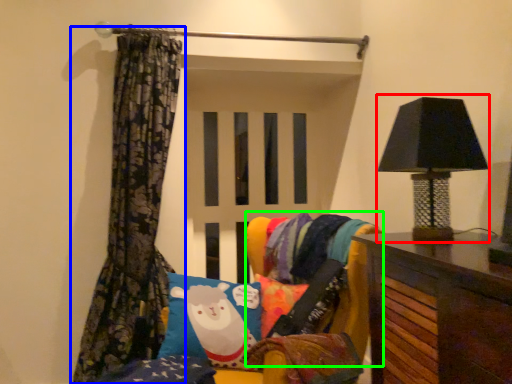
Question: Estimate the real-world distances between objects in this image. Which object is closer to table lamp (highlighted by a red box), curtain (highlighted by a blue box) or bean bag chair (highlighted by a green box)?

Choices:
 (A) curtain
 (B) bean bag chair

Answer: (B)